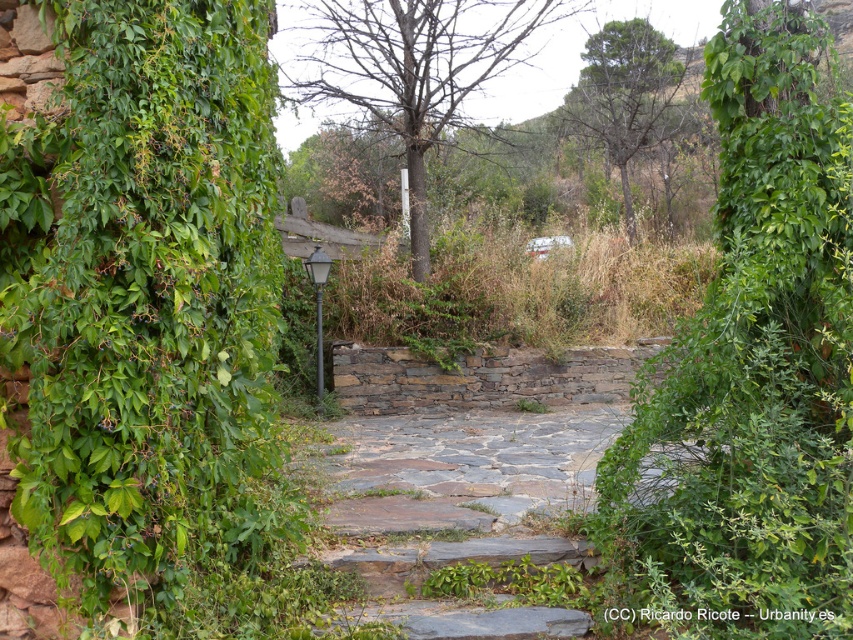
Question: Which point is farther from the camera taking this photo?

Choices:
 (A) (782, 566)
 (B) (543, 552)

Answer: (B)

Question: Is green leafy hedge at center smaller than gray stone steps at center?

Choices:
 (A) no
 (B) yes

Answer: (A)

Question: Is green leafy hedge at center further to the viewer compared to gray stone steps at center?

Choices:
 (A) yes
 (B) no

Answer: (B)

Question: Does green leafy hedge at center have a larger size compared to gray stone steps at center?

Choices:
 (A) no
 (B) yes

Answer: (B)

Question: Among these objects, which one is nearest to the camera?

Choices:
 (A) gray stone steps at center
 (B) green leafy hedge at center

Answer: (B)